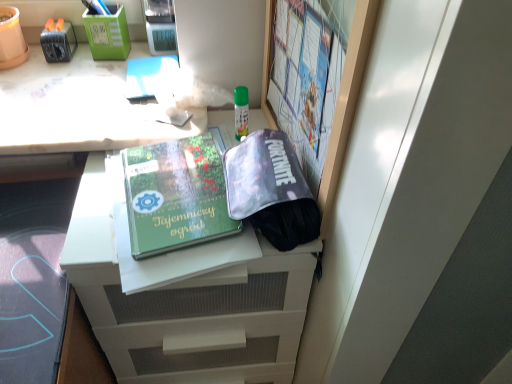
At what (x,y) coordinates should I click in order to perform the action: click on unoccupied region to the right of matte black tape dispenser at upper left, which ranks as the 1th stationery in left-to-right order. Please return your answer as a coordinate pair (x, y). This screenshot has height=384, width=512. Looking at the image, I should click on (103, 67).